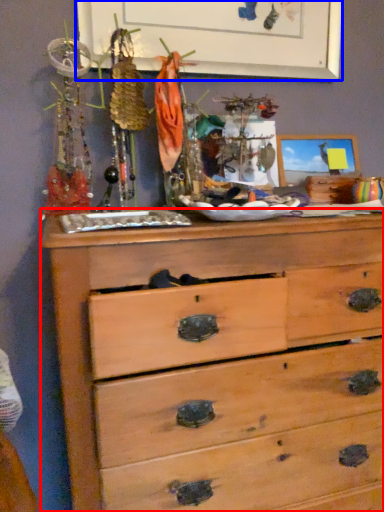
Question: Which point is further to the camera, chest of drawers (highlighted by a red box) or bulletin board (highlighted by a blue box)?

Choices:
 (A) chest of drawers
 (B) bulletin board

Answer: (B)